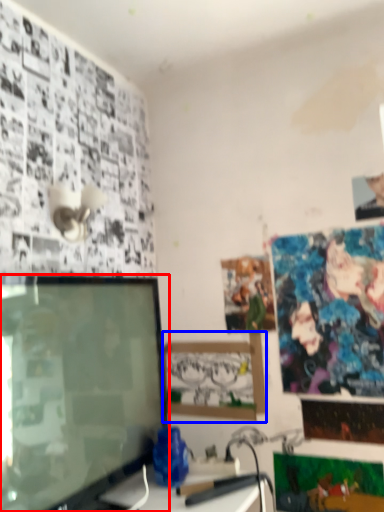
Question: Which point is closer to the camera, television (highlighted by a red box) or picture frame (highlighted by a blue box)?

Choices:
 (A) television
 (B) picture frame

Answer: (A)